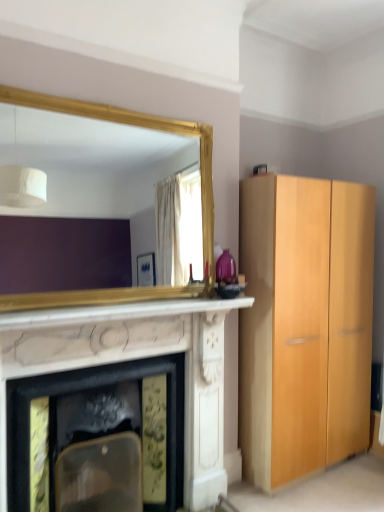
Locate an element on the screen. The width and height of the screenshot is (384, 512). gold-framed mirror at upper left is located at coordinates (90, 162).

Find the location of a particular element. This screenshot has height=512, width=384. white marble fireplace at center is located at coordinates (119, 312).

Considering the sizes of white marble fireplace at center and gold-framed mirror at upper left in the image, is white marble fireplace at center wider or thinner than gold-framed mirror at upper left?

Clearly, white marble fireplace at center has more width compared to gold-framed mirror at upper left.

Is white marble fireplace at center taller than gold-framed mirror at upper left?

No.

How different are the orientations of white marble fireplace at center and gold-framed mirror at upper left in degrees?

1.94 degrees.

Is white marble fireplace at center not near gold-framed mirror at upper left?

white marble fireplace at center is far away from gold-framed mirror at upper left.

Measure the distance from white marble fireplace at center to white marble fireplace at center.

white marble fireplace at center and white marble fireplace at center are 11.05 inches apart from each other.

Which object is thinner, white marble fireplace at center or white marble fireplace at center?

white marble fireplace at center.

Does white marble fireplace at center appear on the right side of white marble fireplace at center?

In fact, white marble fireplace at center is to the left of white marble fireplace at center.

Between white marble fireplace at center and white marble fireplace at center, which one has larger size?

With larger size is white marble fireplace at center.

In terms of width, does gold-framed mirror at upper left look wider or thinner when compared to white marble fireplace at center?

In the image, gold-framed mirror at upper left appears to be more narrow than white marble fireplace at center.

Can you tell me how much gold-framed mirror at upper left and white marble fireplace at center differ in facing direction?

The angular difference between gold-framed mirror at upper left and white marble fireplace at center is 1.94 degrees.

How distant is gold-framed mirror at upper left from white marble fireplace at center?

gold-framed mirror at upper left is 2.32 meters from white marble fireplace at center.

Considering the relative sizes of gold-framed mirror at upper left and white marble fireplace at center in the image provided, is gold-framed mirror at upper left smaller than white marble fireplace at center?

Incorrect, gold-framed mirror at upper left is not smaller in size than white marble fireplace at center.

In the scene shown: From the image's perspective, is white marble fireplace at center over white marble fireplace at center?

Correct, white marble fireplace at center appears higher than white marble fireplace at center in the image.

Is white marble fireplace at center shorter than white marble fireplace at center?

Yes, white marble fireplace at center is shorter than white marble fireplace at center.

Where is `fireplace lying on the left of white marble fireplace at center`? Image resolution: width=384 pixels, height=512 pixels. fireplace lying on the left of white marble fireplace at center is located at coordinates (134, 359).

Considering the positions of objects gold-framed mirror at upper left and white marble fireplace at center in the image provided, who is more to the left, gold-framed mirror at upper left or white marble fireplace at center?

Positioned to the left is white marble fireplace at center.

Which is farther, (x=99, y=188) or (x=73, y=345)?

A: The point (x=99, y=188) is farther.

In the image, is gold-framed mirror at upper left positioned in front of or behind white marble fireplace at center?

Visually, gold-framed mirror at upper left is located behind white marble fireplace at center.

Considering the sizes of gold-framed mirror at upper left and white marble fireplace at center in the image, is gold-framed mirror at upper left taller or shorter than white marble fireplace at center?

Considering their sizes, gold-framed mirror at upper left has less height than white marble fireplace at center.

In the scene shown: Does white marble fireplace at center have a greater height compared to gold-framed mirror at upper left?

Yes, white marble fireplace at center is taller than gold-framed mirror at upper left.

Based on the photo, in the image, is white marble fireplace at center positioned in front of or behind gold-framed mirror at upper left?

In the image, white marble fireplace at center appears in front of gold-framed mirror at upper left.

You are a GUI agent. You are given a task and a screenshot of the screen. Output one action in this format:
    pyautogui.click(x=<x>, y=<y>)
    Task: Click on the mirror above the white marble fireplace at center (from a real-world perspective)
    Image resolution: width=384 pixels, height=512 pixels.
    Given the screenshot: What is the action you would take?
    pyautogui.click(x=90, y=162)

The image size is (384, 512). I want to click on mantle that is on the right side of white marble fireplace at center, so click(x=119, y=312).

When comparing their distances from white marble fireplace at center, does gold-framed mirror at upper left or white marble fireplace at center seem closer?

The object closer to white marble fireplace at center is white marble fireplace at center.

Considering their positions, is white marble fireplace at center positioned further to gold-framed mirror at upper left than white marble fireplace at center?

white marble fireplace at center lies further to gold-framed mirror at upper left than the other object.

Estimate the real-world distances between objects in this image. Which object is closer to white marble fireplace at center, white marble fireplace at center or gold-framed mirror at upper left?

white marble fireplace at center.

When comparing their distances from white marble fireplace at center, does white marble fireplace at center or gold-framed mirror at upper left seem further?

gold-framed mirror at upper left.

Considering their positions, is gold-framed mirror at upper left positioned closer to white marble fireplace at center than white marble fireplace at center?

Based on the image, white marble fireplace at center appears to be nearer to white marble fireplace at center.

Considering their positions, is white marble fireplace at center positioned closer to gold-framed mirror at upper left than white marble fireplace at center?

white marble fireplace at center lies closer to gold-framed mirror at upper left than the other object.

Where is `mantle between gold-framed mirror at upper left and white marble fireplace at center in the up-down direction`? Image resolution: width=384 pixels, height=512 pixels. mantle between gold-framed mirror at upper left and white marble fireplace at center in the up-down direction is located at coordinates (119, 312).